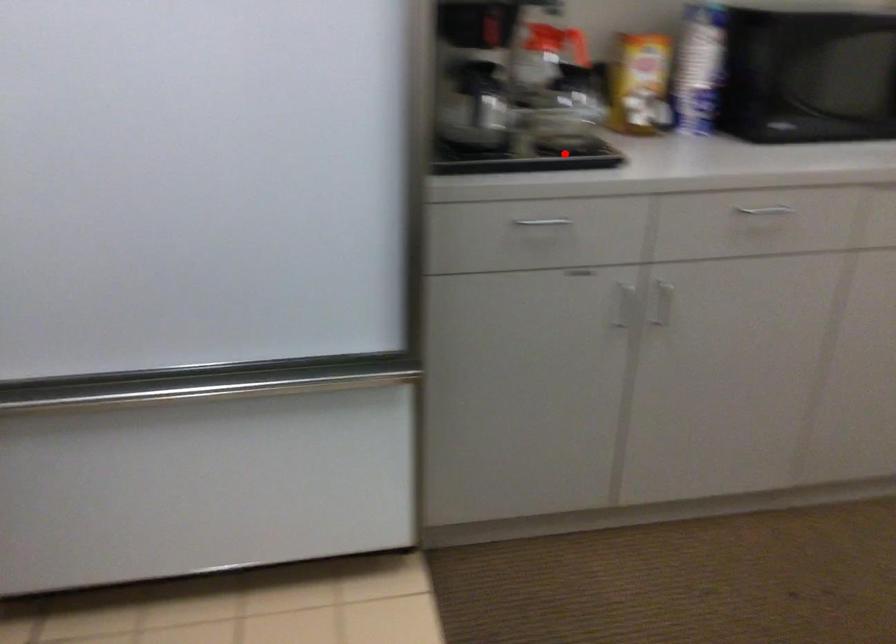
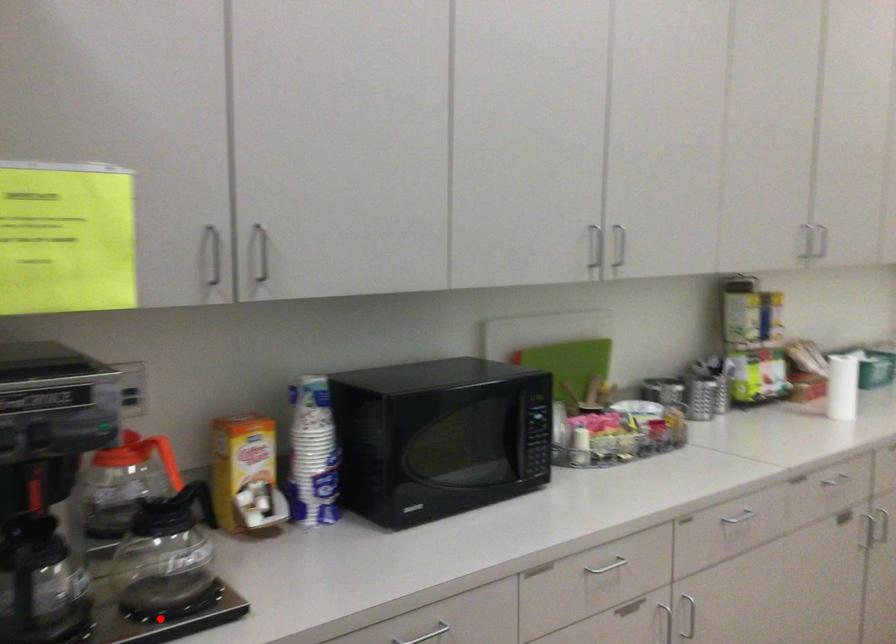
Looking at this image, I am providing you with two images of the same scene from different viewpoints. A red point is marked on the first image and another point is marked on the second image. Are the points marked in image1 and image2 representing the same 3D position?

Yes